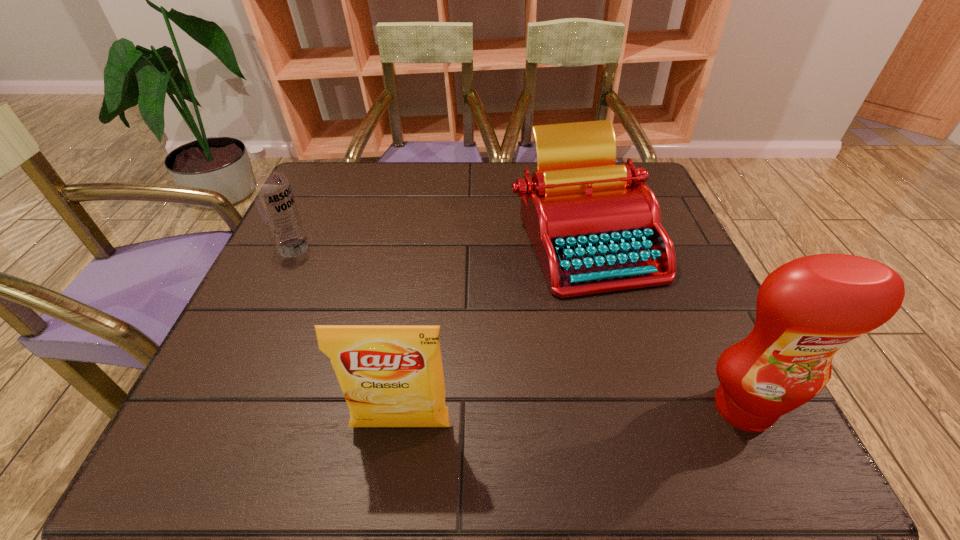
Image resolution: width=960 pixels, height=540 pixels. What are the coordinates of `free spot on the desktop that is between the third object from right to left and the condiment and is positioned on the front label of the vodka` in the screenshot? It's located at (526, 420).

Where is `free spot on the desktop that is between the crisp (potato chip) and the condiment and is positioned on the typing side of the typewriter`? free spot on the desktop that is between the crisp (potato chip) and the condiment and is positioned on the typing side of the typewriter is located at coordinates (533, 420).